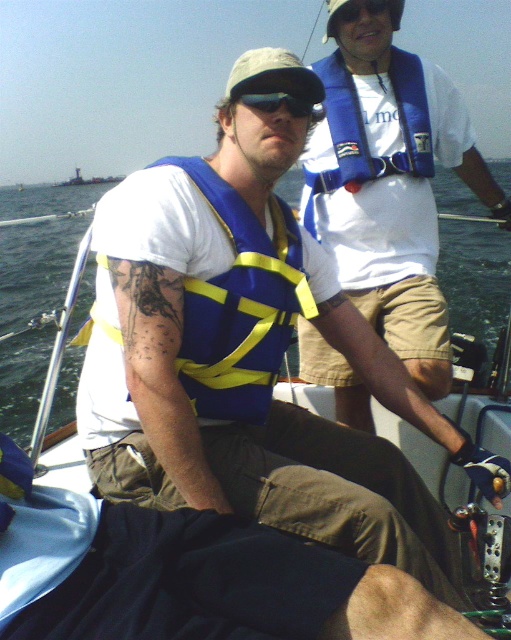
Between blue/yellow life vest at center and black plastic goggles at center, which one is positioned higher?

blue/yellow life vest at center is above.

Can you confirm if blue/yellow life vest at center is shorter than black plastic goggles at center?

Incorrect, blue/yellow life vest at center's height does not fall short of black plastic goggles at center's.

At what (x,y) coordinates should I click in order to perform the action: click on blue/yellow life vest at center. Please return your answer as a coordinate pair (x, y). Looking at the image, I should click on (476, 276).

The height and width of the screenshot is (640, 511). Find the location of `blue/yellow life vest at center`. blue/yellow life vest at center is located at coordinates (476, 276).

Does point (380, 164) come behind point (259, 99)?

Yes, point (380, 164) is behind point (259, 99).

Can you confirm if blue fabric life vest at center is shorter than black plastic goggles at center?

No.

Measure the distance between point [363,120] and camera.

Point [363,120] and camera are 8.88 feet apart from each other.

Find the location of `blue fabric life vest at center`. blue fabric life vest at center is located at coordinates (389, 182).

Is blue fabric life vest at center in front of blue/yellow fabric life vest at center?

No, it is behind blue/yellow fabric life vest at center.

From the picture: Which of these two, blue fabric life vest at center or blue/yellow fabric life vest at center, stands taller?

blue fabric life vest at center

Is point (439, 317) closer to camera compared to point (211, 307)?

That is False.

This screenshot has height=640, width=511. I want to click on blue fabric life vest at center, so click(x=389, y=182).